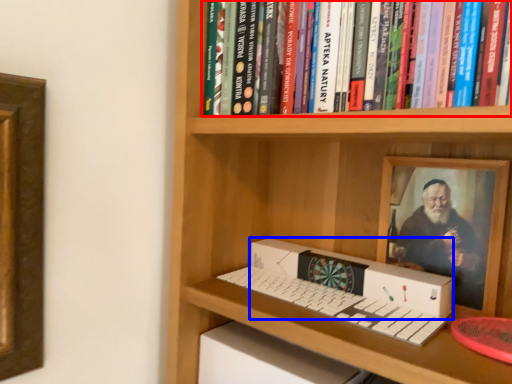
Question: Which object is further to the camera taking this photo, book (highlighted by a red box) or box (highlighted by a blue box)?

Choices:
 (A) book
 (B) box

Answer: (B)